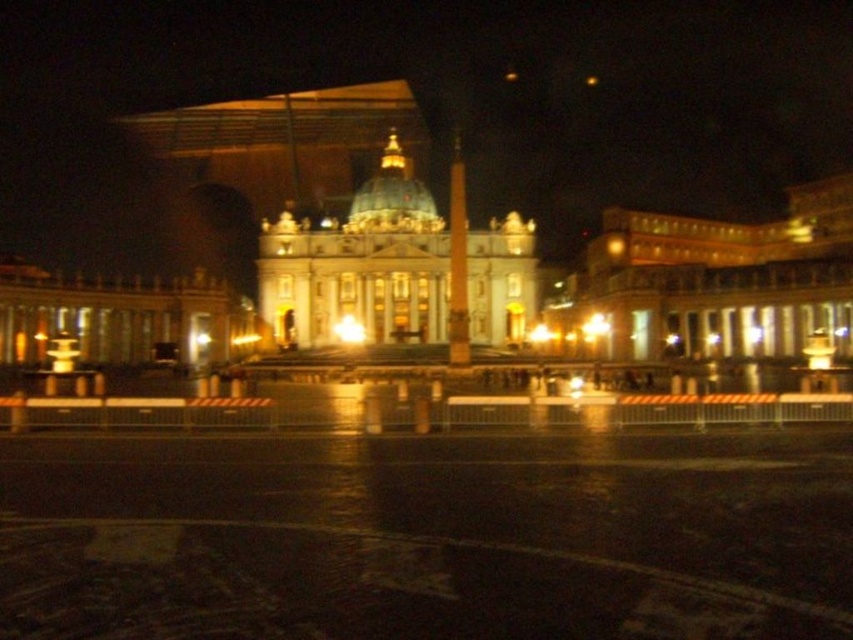
Question: In this image, where is light brown stone building at right located relative to white marble palace at center?

Choices:
 (A) above
 (B) below

Answer: (B)

Question: Among these points, which one is nearest to the camera?

Choices:
 (A) (335, 314)
 (B) (592, 264)
 (C) (457, 214)

Answer: (C)

Question: Among these objects, which one is nearest to the camera?

Choices:
 (A) light brown stone building at right
 (B) white marble palace at center

Answer: (A)

Question: Can you confirm if light brown stone building at right is bigger than white marble palace at center?

Choices:
 (A) yes
 (B) no

Answer: (B)

Question: Is light brown stone building at right to the right of white marble palace at center from the viewer's perspective?

Choices:
 (A) yes
 (B) no

Answer: (A)

Question: Which point is farther to the camera?

Choices:
 (A) (372, 260)
 (B) (450, 177)

Answer: (B)